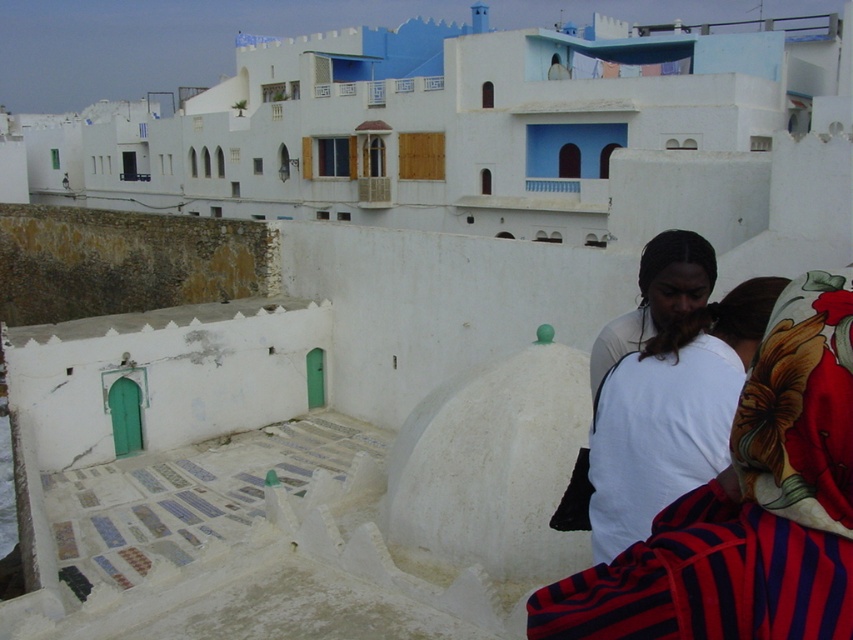
Question: Does floral fabric headscarf at right appear on the right side of white cotton shirt at right?

Choices:
 (A) yes
 (B) no

Answer: (B)

Question: Is floral fabric headscarf at right positioned before white cotton shirt at right?

Choices:
 (A) no
 (B) yes

Answer: (B)

Question: Can you confirm if floral fabric headscarf at right is wider than white cotton shirt at right?

Choices:
 (A) no
 (B) yes

Answer: (B)